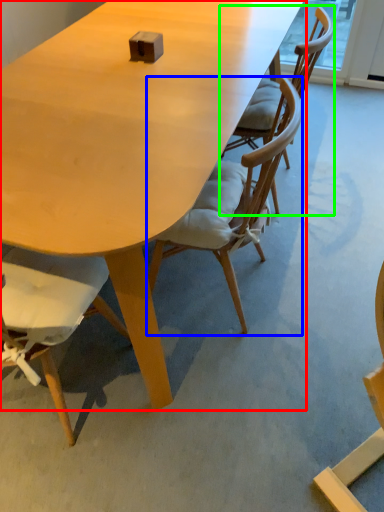
Question: Considering the real-world distances, which object is farthest from table (highlighted by a red box)? chair (highlighted by a blue box) or chair (highlighted by a green box)?

Choices:
 (A) chair
 (B) chair

Answer: (B)